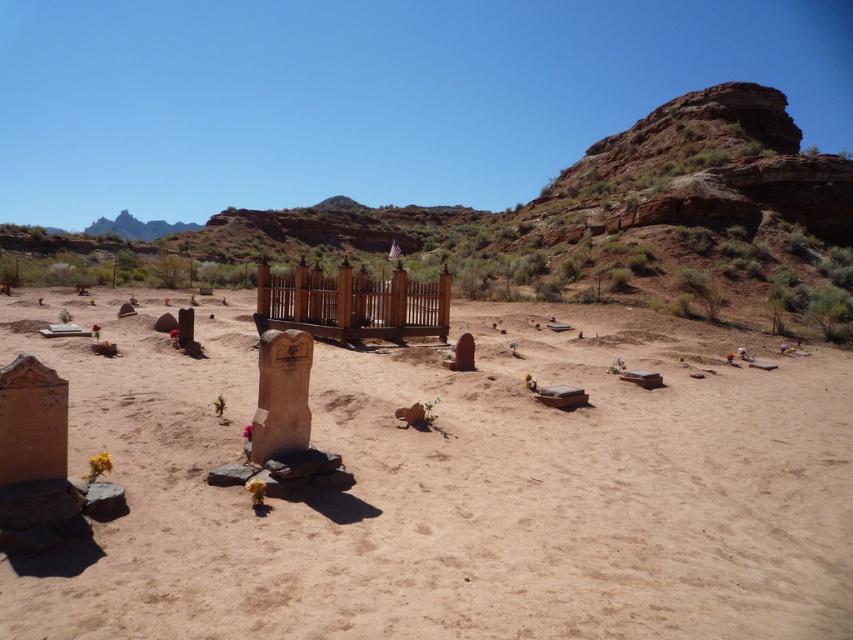
Question: Does brown sandy dirt field at center appear on the left side of wooden fence at center?

Choices:
 (A) yes
 (B) no

Answer: (A)

Question: Among these objects, which one is nearest to the camera?

Choices:
 (A) wooden fence at center
 (B) brown sandy dirt field at center

Answer: (B)

Question: Which of the following is the closest to the observer?

Choices:
 (A) brown sandy dirt field at center
 (B) wooden fence at center

Answer: (A)

Question: Is brown sandy dirt field at center positioned behind wooden fence at center?

Choices:
 (A) yes
 (B) no

Answer: (B)

Question: Can you confirm if brown sandy dirt field at center is positioned above wooden fence at center?

Choices:
 (A) yes
 (B) no

Answer: (B)